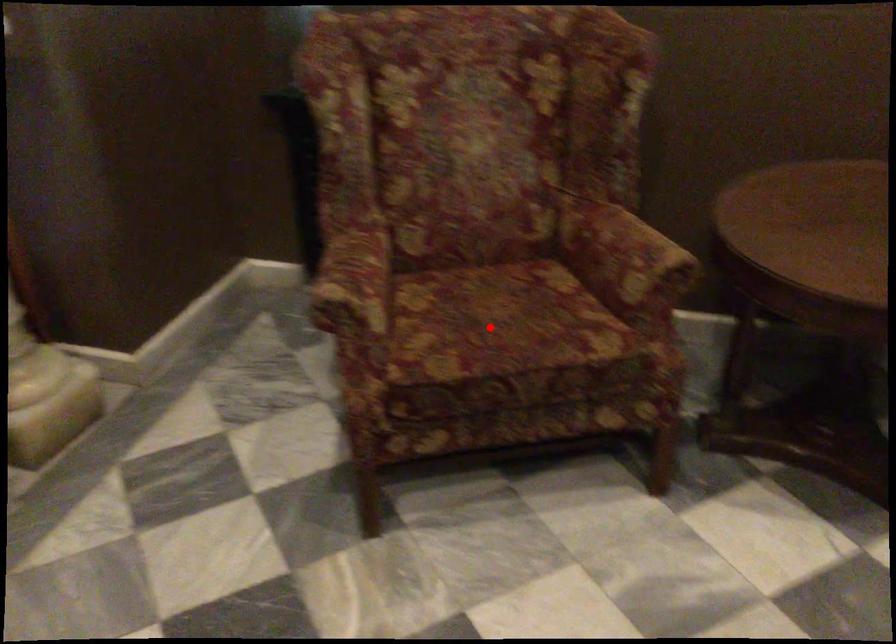
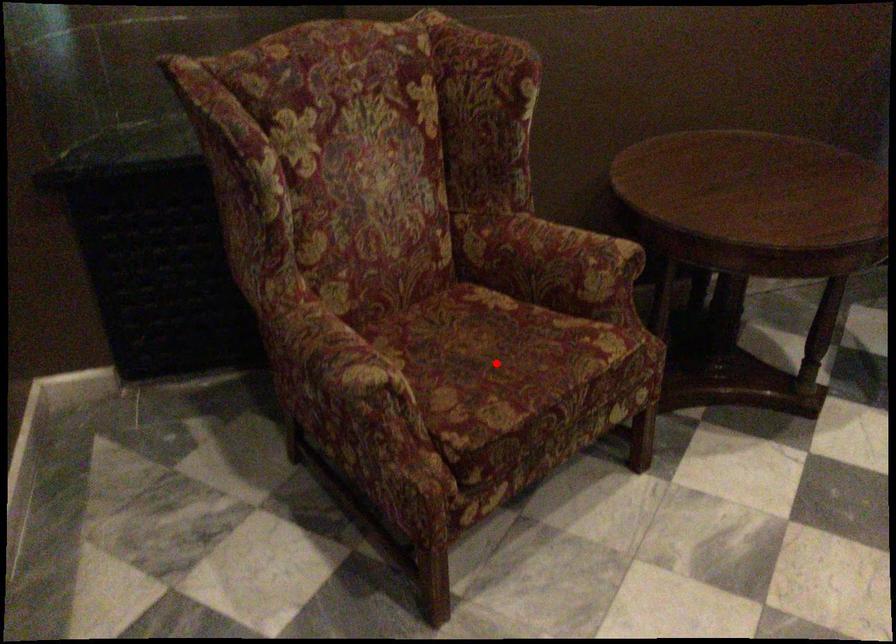
From the picture: I am providing you with two images of the same scene from different viewpoints. A red point is marked on the first image and another point is marked on the second image. Is the marked point in image1 the same physical position as the marked point in image2?

Yes